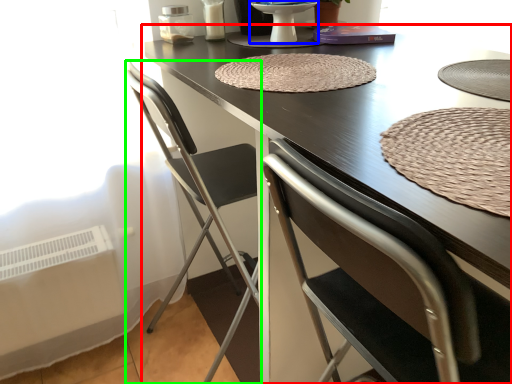
Question: Based on their relative distances, which object is farther from table (highlighted by a red box)? Choose from round table (highlighted by a blue box) and chair (highlighted by a green box).

Choices:
 (A) round table
 (B) chair

Answer: (A)